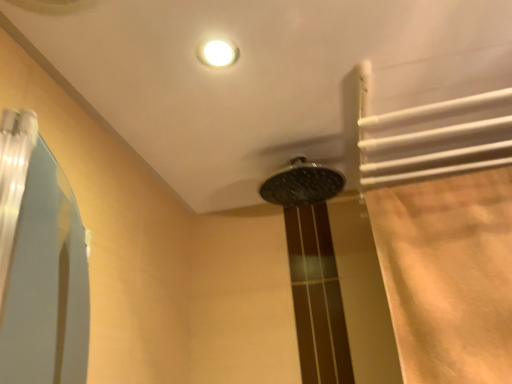
Question: From a real-world perspective, is polished chrome showerhead at center positioned above or below beige fabric shower curtain at right?

Choices:
 (A) above
 (B) below

Answer: (A)

Question: Is polished chrome showerhead at center in front of or behind beige fabric shower curtain at right in the image?

Choices:
 (A) behind
 (B) front

Answer: (A)

Question: From the image's perspective, relative to beige fabric shower curtain at right, is polished chrome showerhead at center above or below?

Choices:
 (A) below
 (B) above

Answer: (B)

Question: Is beige fabric shower curtain at right inside or outside of polished chrome showerhead at center?

Choices:
 (A) outside
 (B) inside

Answer: (A)

Question: Considering the relative positions of beige fabric shower curtain at right and polished chrome showerhead at center in the image provided, is beige fabric shower curtain at right to the left or to the right of polished chrome showerhead at center?

Choices:
 (A) left
 (B) right

Answer: (B)

Question: Is beige fabric shower curtain at right bigger or smaller than polished chrome showerhead at center?

Choices:
 (A) big
 (B) small

Answer: (A)

Question: Is beige fabric shower curtain at right taller or shorter than polished chrome showerhead at center?

Choices:
 (A) short
 (B) tall

Answer: (B)